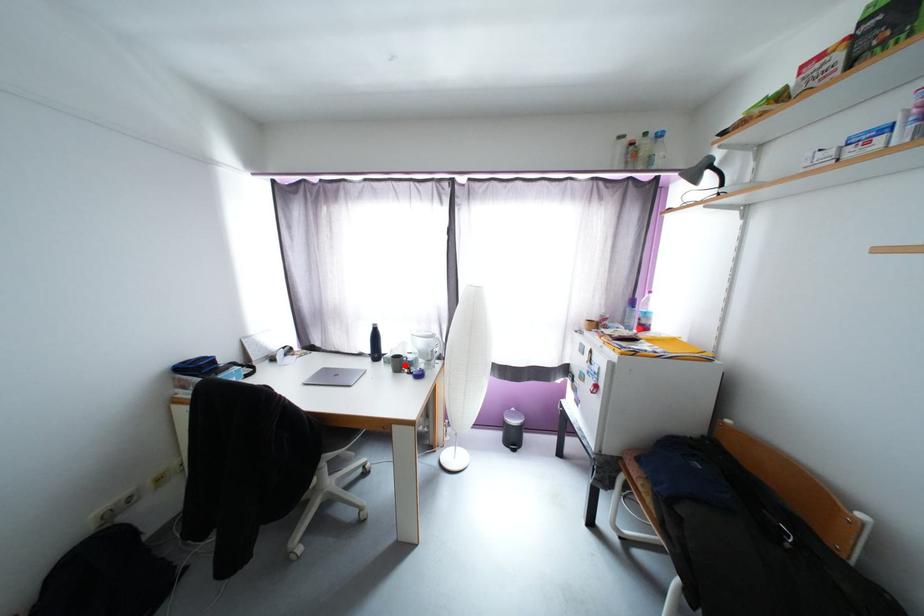
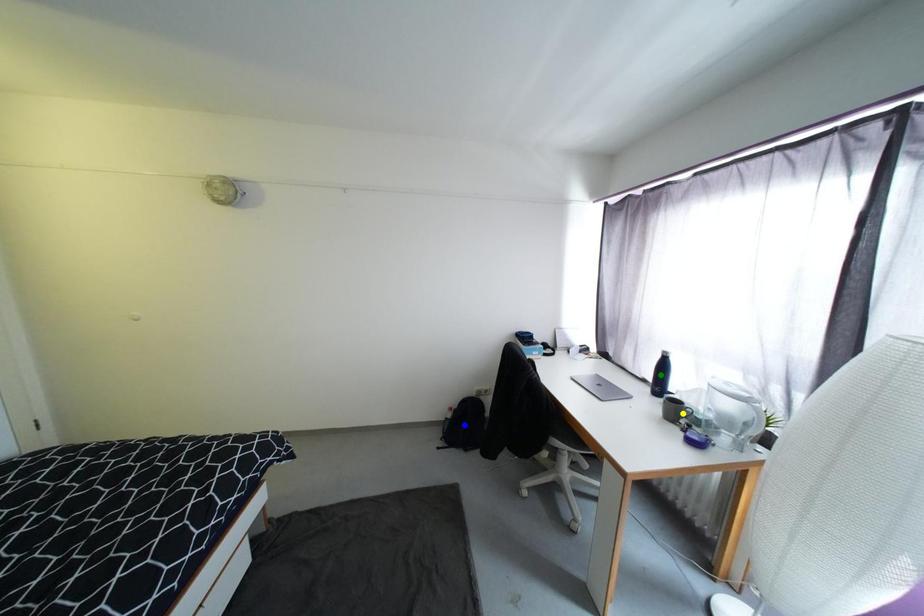
Question: I am providing you with two images of the same scene from different viewpoints. A red point is marked on the first image. You are given multiple points on the second image. Which point in image 2 is actually the same real-world point as the red point in image 1?

Choices:
 (A) green point
 (B) blue point
 (C) yellow point

Answer: (C)